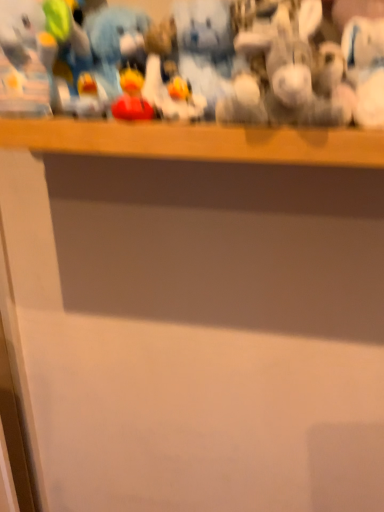
This screenshot has width=384, height=512. What are the coordinates of `fuzzy plush toy at center, marked as the first toy in a back-to-front arrangement` in the screenshot? It's located at (205, 48).

Describe the element at coordinates (205, 48) in the screenshot. I see `fuzzy plush toy at center, the first toy from the top` at that location.

Identify the location of matte plastic toy at center, the 2th toy in the back-to-front sequence. (131, 97).

In order to face matte plastic toy at center, the 1th toy from the left, should I rotate leftwards or rightwards?

You should look left and rotate roughly 8.485 degrees.

What do you see at coordinates (131, 97) in the screenshot?
I see `matte plastic toy at center, which is the 1th toy in front-to-back order` at bounding box center [131, 97].

Locate an element on the screen. The height and width of the screenshot is (512, 384). fuzzy plush toy at center, positioned as the first toy in right-to-left order is located at coordinates (205, 48).

Does matte plastic toy at center, which is the second toy from top to bottom, appear on the right side of fuzzy plush toy at center, marked as the first toy in a back-to-front arrangement?

No, matte plastic toy at center, which is the second toy from top to bottom, is not to the right of fuzzy plush toy at center, marked as the first toy in a back-to-front arrangement.

Looking at this image, is matte plastic toy at center, which is the second toy from top to bottom, positioned in front of fuzzy plush toy at center, the first toy from the top?

Yes, it is in front of fuzzy plush toy at center, the first toy from the top.

Is point (128, 76) farther from viewer compared to point (187, 33)?

No, it is in front of (187, 33).

From the image's perspective, is matte plastic toy at center, marked as the 2th toy in a right-to-left arrangement, positioned above or below fuzzy plush toy at center, the first toy from the top?

matte plastic toy at center, marked as the 2th toy in a right-to-left arrangement, is situated lower than fuzzy plush toy at center, the first toy from the top, in the image.

From a real-world perspective, does matte plastic toy at center, which is the second toy from top to bottom, sit lower than fuzzy plush toy at center, acting as the second toy starting from the bottom?

Yes, from a real-world perspective, matte plastic toy at center, which is the second toy from top to bottom, is under fuzzy plush toy at center, acting as the second toy starting from the bottom.

Can you confirm if matte plastic toy at center, marked as the 2th toy in a right-to-left arrangement, is wider than fuzzy plush toy at center, arranged as the 2th toy when viewed from the left?

No.

Is matte plastic toy at center, the 2th toy in the back-to-front sequence, taller or shorter than fuzzy plush toy at center, arranged as the 2th toy when viewed from the left?

In the image, matte plastic toy at center, the 2th toy in the back-to-front sequence, appears to be shorter than fuzzy plush toy at center, arranged as the 2th toy when viewed from the left.

Which of these two, matte plastic toy at center, the 1th toy from the left, or fuzzy plush toy at center, the first toy from the top, is bigger?

Bigger between the two is fuzzy plush toy at center, the first toy from the top.

Is fuzzy plush toy at center, positioned as the first toy in right-to-left order, completely or partially inside matte plastic toy at center, the 2th toy in the back-to-front sequence?

No, fuzzy plush toy at center, positioned as the first toy in right-to-left order, is not inside matte plastic toy at center, the 2th toy in the back-to-front sequence.

Is matte plastic toy at center, which is the second toy from top to bottom, placed right next to fuzzy plush toy at center, acting as the second toy starting from the bottom?

matte plastic toy at center, which is the second toy from top to bottom, and fuzzy plush toy at center, acting as the second toy starting from the bottom, are clearly separated.

Is matte plastic toy at center, which is the 1th toy in front-to-back order, aimed at fuzzy plush toy at center, placed as the second toy when sorted from front to back?

No.

Looking at this image, how much distance is there between matte plastic toy at center, the 1th toy from the left, and fuzzy plush toy at center, positioned as the first toy in right-to-left order?

matte plastic toy at center, the 1th toy from the left, is 6.23 inches away from fuzzy plush toy at center, positioned as the first toy in right-to-left order.

Image resolution: width=384 pixels, height=512 pixels. Find the location of `toy that appears above the matte plastic toy at center, which is the 1th toy in front-to-back order (from the image's perspective)`. toy that appears above the matte plastic toy at center, which is the 1th toy in front-to-back order (from the image's perspective) is located at coordinates (205, 48).

Does fuzzy plush toy at center, the first toy from the top, appear on the left side of matte plastic toy at center, the 2th toy in the back-to-front sequence?

No.

Which object is further away from the camera, fuzzy plush toy at center, arranged as the 2th toy when viewed from the left, or matte plastic toy at center, arranged as the 1th toy when ordered from the bottom?

fuzzy plush toy at center, arranged as the 2th toy when viewed from the left, is more distant.

Considering the points (225, 93) and (113, 108), which point is behind, point (225, 93) or point (113, 108)?

The point (225, 93) is farther from the camera.

From the image's perspective, which is below, fuzzy plush toy at center, acting as the second toy starting from the bottom, or matte plastic toy at center, marked as the 2th toy in a right-to-left arrangement?

matte plastic toy at center, marked as the 2th toy in a right-to-left arrangement, appears lower in the image.

From a real-world perspective, which object stands above the other?

In real-world perspective, fuzzy plush toy at center, positioned as the first toy in right-to-left order, is above.

Considering the sizes of objects fuzzy plush toy at center, acting as the second toy starting from the bottom, and matte plastic toy at center, the 1th toy from the left, in the image provided, who is wider, fuzzy plush toy at center, acting as the second toy starting from the bottom, or matte plastic toy at center, the 1th toy from the left,?

With larger width is fuzzy plush toy at center, acting as the second toy starting from the bottom.

Considering the sizes of fuzzy plush toy at center, positioned as the first toy in right-to-left order, and matte plastic toy at center, the 1th toy from the left, in the image, is fuzzy plush toy at center, positioned as the first toy in right-to-left order, taller or shorter than matte plastic toy at center, the 1th toy from the left,?

Clearly, fuzzy plush toy at center, positioned as the first toy in right-to-left order, is taller compared to matte plastic toy at center, the 1th toy from the left.

Based on the photo, between fuzzy plush toy at center, the first toy from the top, and matte plastic toy at center, arranged as the 1th toy when ordered from the bottom, which one has smaller size?

With smaller size is matte plastic toy at center, arranged as the 1th toy when ordered from the bottom.

Choose the correct answer: Is fuzzy plush toy at center, acting as the second toy starting from the bottom, inside matte plastic toy at center, the 1th toy from the left, or outside it?

fuzzy plush toy at center, acting as the second toy starting from the bottom, cannot be found inside matte plastic toy at center, the 1th toy from the left.

Is fuzzy plush toy at center, marked as the first toy in a back-to-front arrangement, beside matte plastic toy at center, which is the 1th toy in front-to-back order?

There is a gap between fuzzy plush toy at center, marked as the first toy in a back-to-front arrangement, and matte plastic toy at center, which is the 1th toy in front-to-back order.

Could you tell me if fuzzy plush toy at center, marked as the first toy in a back-to-front arrangement, is turned towards matte plastic toy at center, which is the 1th toy in front-to-back order?

Yes, fuzzy plush toy at center, marked as the first toy in a back-to-front arrangement, is oriented towards matte plastic toy at center, which is the 1th toy in front-to-back order.

Can you tell me how much fuzzy plush toy at center, placed as the second toy when sorted from front to back, and matte plastic toy at center, arranged as the 1th toy when ordered from the bottom, differ in facing direction?

The facing directions of fuzzy plush toy at center, placed as the second toy when sorted from front to back, and matte plastic toy at center, arranged as the 1th toy when ordered from the bottom, are 0.937 degrees apart.

This screenshot has width=384, height=512. Identify the location of toy below the fuzzy plush toy at center, marked as the first toy in a back-to-front arrangement (from a real-world perspective). (131, 97).

Identify the location of toy below the fuzzy plush toy at center, the first toy from the top (from a real-world perspective). (131, 97).

Locate an element on the screen. This screenshot has height=512, width=384. toy on the right of the matte plastic toy at center, which is the second toy from top to bottom is located at coordinates (205, 48).